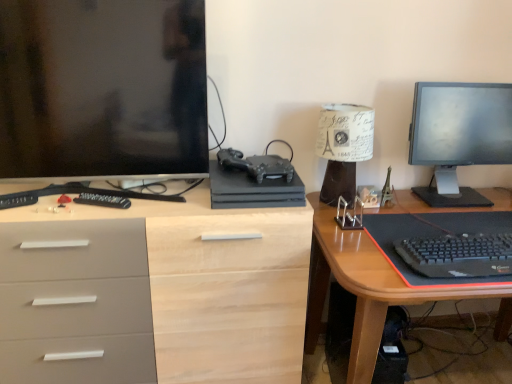
Identify the location of empty space that is ontop of black matte keyboard at lower right (from a real-world perspective). The width and height of the screenshot is (512, 384). (470, 242).